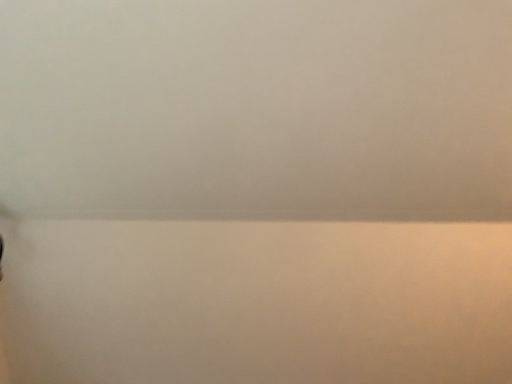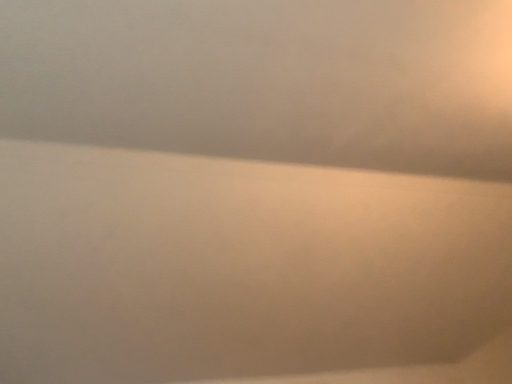
Question: Which way did the camera rotate in the video?

Choices:
 (A) rotated right
 (B) rotated left

Answer: (A)